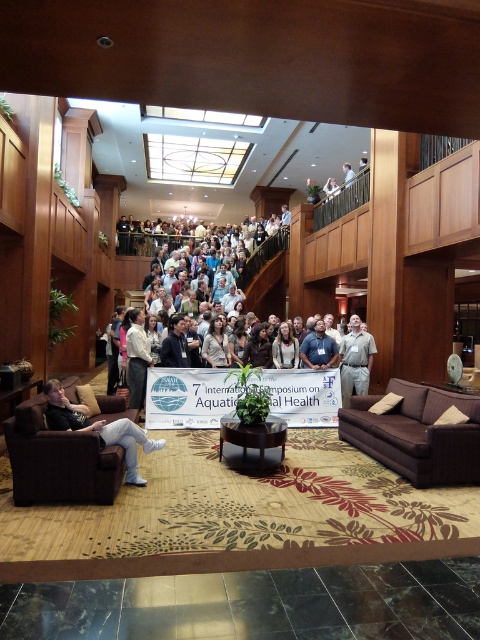
Between dark gray fabric couch at lower left and white shirt at center, which one appears on the left side from the viewer's perspective?

white shirt at center

Can you confirm if dark gray fabric couch at lower left is positioned below white shirt at center?

Yes, dark gray fabric couch at lower left is below white shirt at center.

The width and height of the screenshot is (480, 640). What are the coordinates of `dark gray fabric couch at lower left` in the screenshot? It's located at pyautogui.click(x=98, y=428).

Where is `dark gray fabric couch at lower left`? dark gray fabric couch at lower left is located at coordinates (98, 428).

Who is lower down, dark gray fabric couch at lower left or light gray uniform at center?

dark gray fabric couch at lower left is lower down.

Is point (107, 444) farther from viewer compared to point (371, 337)?

No, it is not.

What do you see at coordinates (98, 428) in the screenshot? The width and height of the screenshot is (480, 640). I see `dark gray fabric couch at lower left` at bounding box center [98, 428].

You are a GUI agent. You are given a task and a screenshot of the screen. Output one action in this format:
    pyautogui.click(x=<x>, y=<y>)
    Task: Click on the dark gray fabric couch at lower left
    
    Given the screenshot: What is the action you would take?
    pyautogui.click(x=98, y=428)

Between light blue shirt at center and white fabric at upper center, which one is positioned higher?

white fabric at upper center

Consider the image. Is light blue shirt at center above white fabric at upper center?

No, light blue shirt at center is not above white fabric at upper center.

Does point (310, 355) lie behind point (348, 173)?

No, it is not.

The height and width of the screenshot is (640, 480). Identify the location of light blue shirt at center. (319, 348).